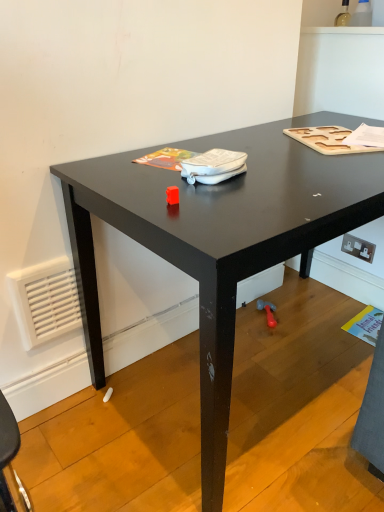
Where is `matte black table at center`? matte black table at center is located at coordinates (219, 240).

What do you see at coordinates (219, 240) in the screenshot?
I see `matte black table at center` at bounding box center [219, 240].

Find the location of a particular element. The image size is (384, 512). matte black table at center is located at coordinates click(x=219, y=240).